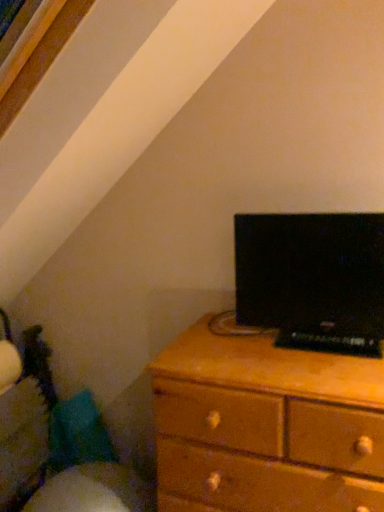
Find the location of a particular element. empty space that is ontop of wooden chest of drawers at lower right is located at coordinates (258, 349).